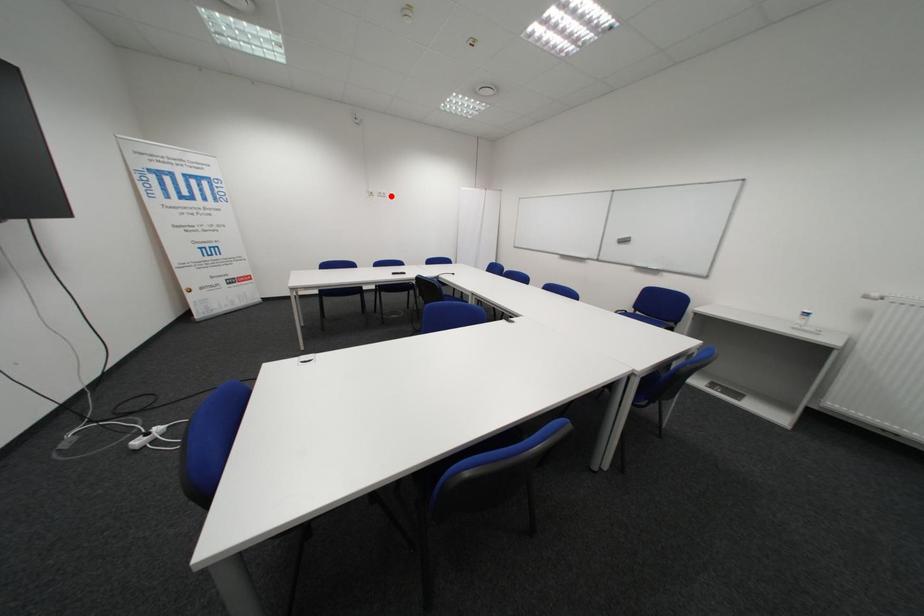
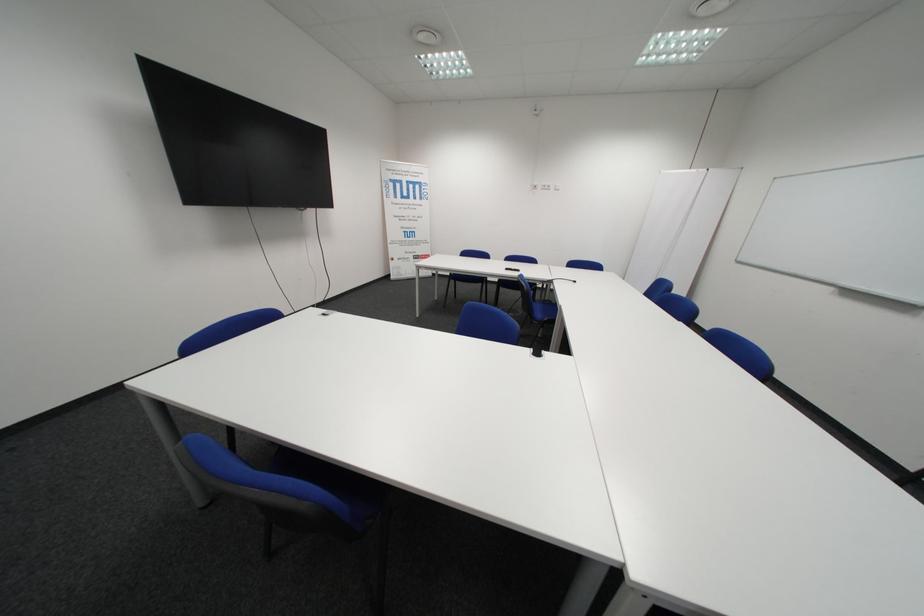
Locate, in the second image, the point that corresponds to the highlighted location in the first image.

(554, 188)